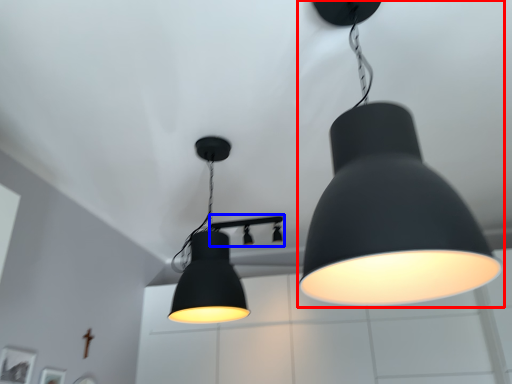
Question: Which object is closer to the camera taking this photo, lamp (highlighted by a red box) or lamp (highlighted by a blue box)?

Choices:
 (A) lamp
 (B) lamp

Answer: (A)